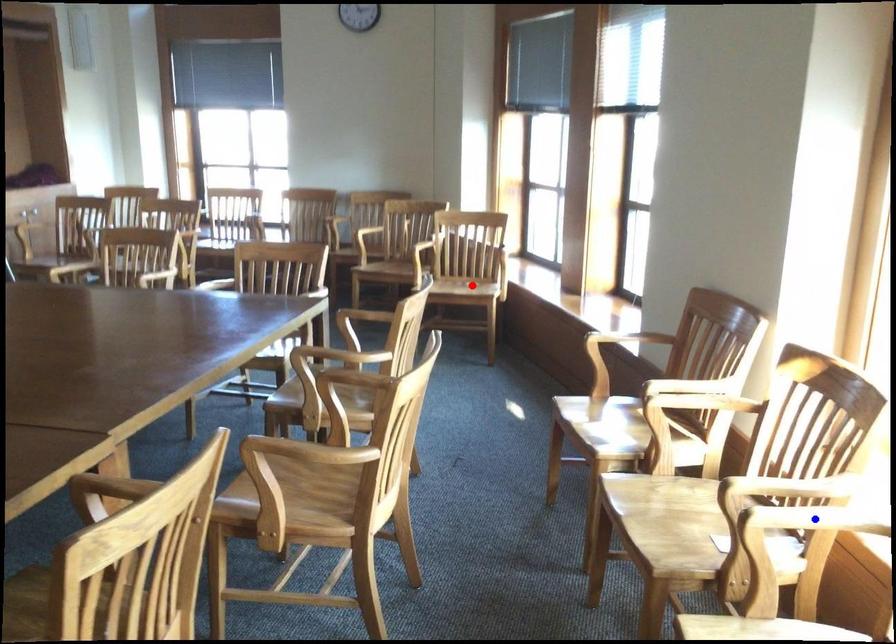
Question: Two points are marked on the image. Which point is closer to the camera?

Choices:
 (A) Blue point is closer.
 (B) Red point is closer.

Answer: (A)